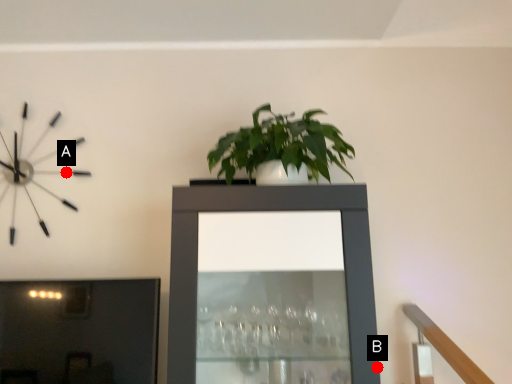
Question: Two points are circled on the image, labeled by A and B beside each circle. Which of the following is the closest to the observer?

Choices:
 (A) A is closer
 (B) B is closer

Answer: (B)